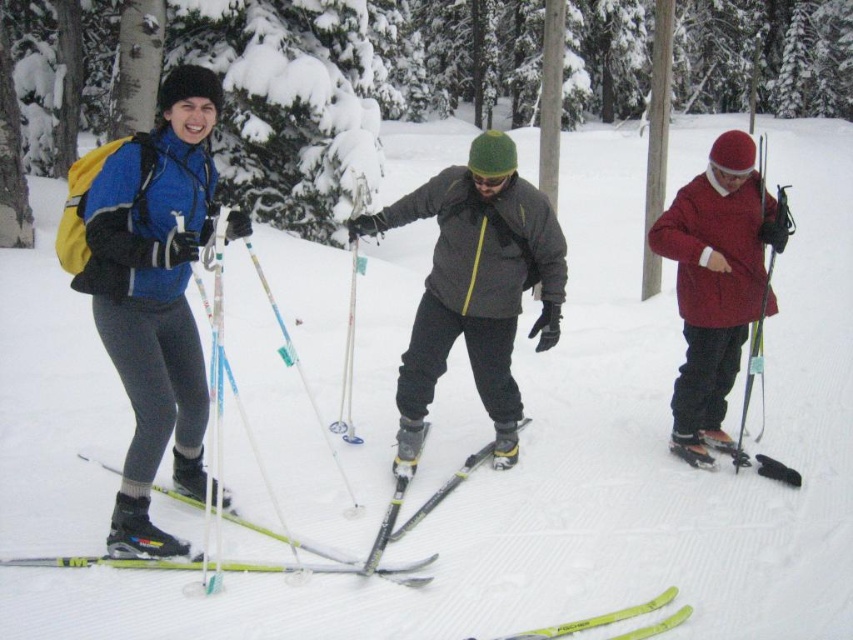
Question: Does matte blue jacket at left have a smaller size compared to yellow matte skis at lower center?

Choices:
 (A) no
 (B) yes

Answer: (A)

Question: From the image, what is the correct spatial relationship of matte blue jacket at left in relation to matte red jacket at center?

Choices:
 (A) above
 (B) below

Answer: (B)

Question: Estimate the real-world distances between objects in this image. Which object is farther from the shiny black ski at center?

Choices:
 (A) dark gray matte jacket at center
 (B) matte red jacket at center

Answer: (B)

Question: Considering the relative positions of shiny black ski at center and yellow matte skis at lower center in the image provided, where is shiny black ski at center located with respect to yellow matte skis at lower center?

Choices:
 (A) right
 (B) left

Answer: (B)

Question: Which object is the farthest from the shiny black ski at center?

Choices:
 (A) dark gray matte jacket at center
 (B) matte blue jacket at left

Answer: (B)

Question: Based on their relative distances, which object is farther from the matte blue jacket at left?

Choices:
 (A) dark gray matte jacket at center
 (B) matte red jacket at center

Answer: (B)